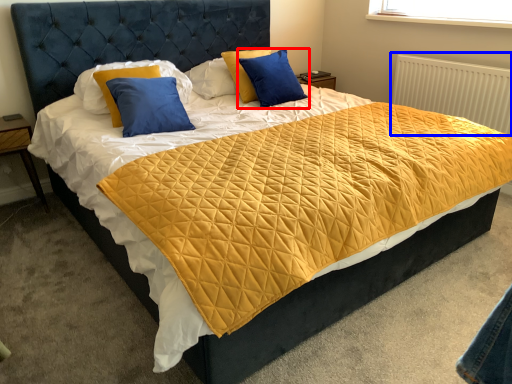
Question: Which point is further to the camera, pillow (highlighted by a red box) or radiator (highlighted by a blue box)?

Choices:
 (A) pillow
 (B) radiator

Answer: (B)